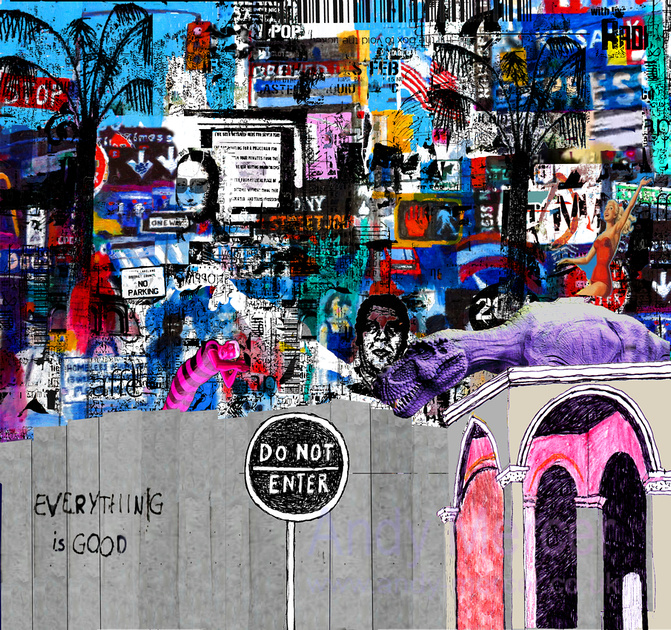
What are the coordinates of `artwork` in the screenshot? It's located at (342, 247).